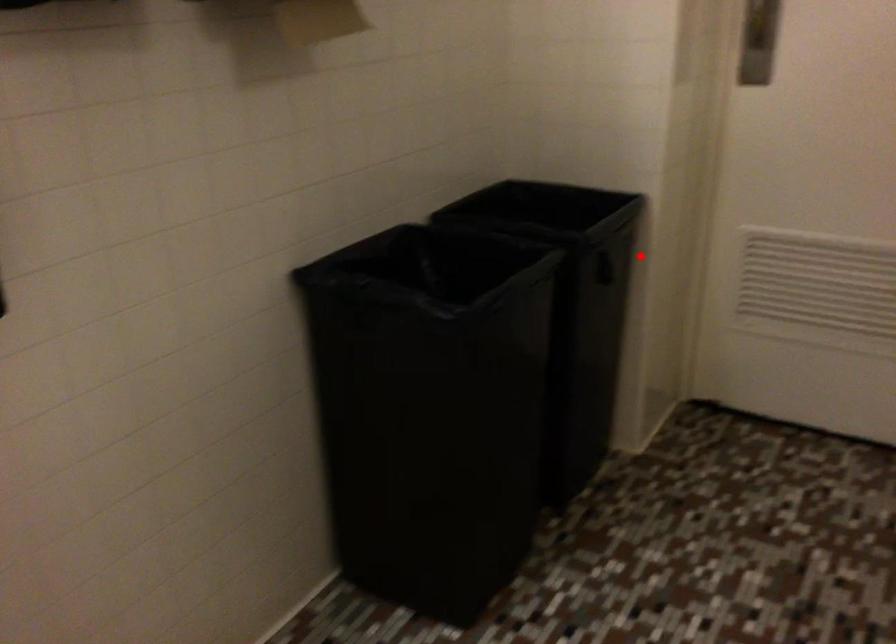
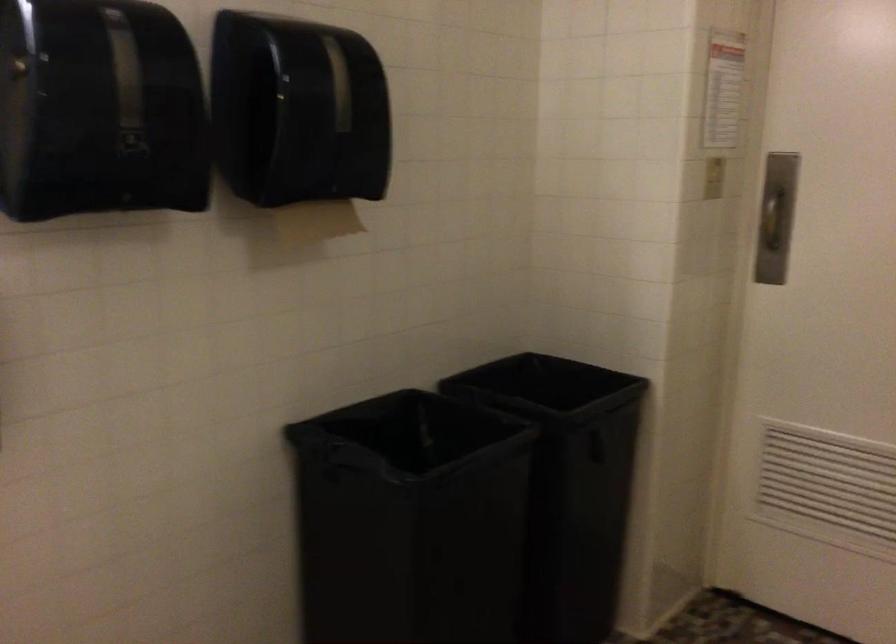
Find the pixel in the second image that matches the highlighted location in the first image.

(647, 438)